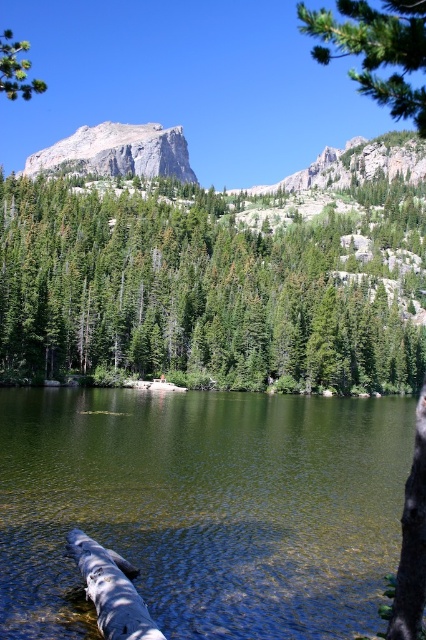
Question: Among these objects, which one is nearest to the camera?

Choices:
 (A) green textured pine tree at upper right
 (B) brown rough tree trunk at right
 (C) green textured trees at center

Answer: (B)

Question: Which object is closer to the camera taking this photo?

Choices:
 (A) brown rough tree trunk at right
 (B) green leafy tree at upper left
 (C) green smooth water at center

Answer: (A)

Question: Considering the relative positions of green textured pine tree at upper right and smooth gray log at lower left in the image provided, where is green textured pine tree at upper right located with respect to smooth gray log at lower left?

Choices:
 (A) above
 (B) below

Answer: (A)

Question: Is brown rough tree trunk at right to the right of smooth gray log at lower left from the viewer's perspective?

Choices:
 (A) yes
 (B) no

Answer: (A)

Question: Which point is closer to the camera?

Choices:
 (A) green leafy tree at upper left
 (B) rugged stone mountain at upper center
 (C) green textured pine tree at upper right
 (D) green textured trees at center

Answer: (C)

Question: Can you confirm if green textured pine tree at upper right is positioned below green leafy tree at upper left?

Choices:
 (A) yes
 (B) no

Answer: (B)